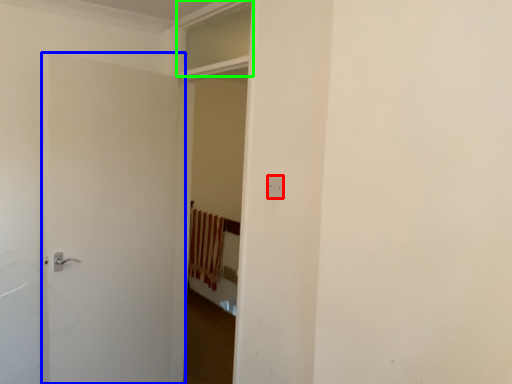
Question: Which is farther away from electric outlet (highlighted by a red box)? door (highlighted by a blue box) or window (highlighted by a green box)?

Choices:
 (A) door
 (B) window

Answer: (A)